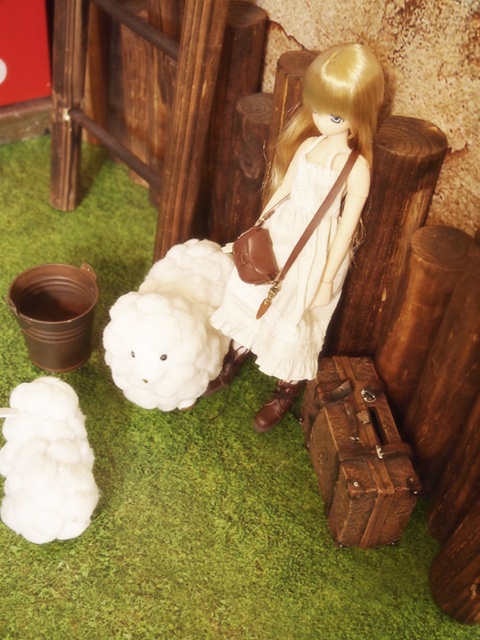
Who is taller, rustic leather suitcase at lower right or white fluffy toy at lower left?

rustic leather suitcase at lower right is taller.

Who is more forward, [357,515] or [74,408]?

Point [357,515] is in front.

In order to click on rustic leather suitcase at lower right in this screenshot , I will do `click(358, 452)`.

Does white cotton dress at center come behind white fluffy toy at lower left?

No.

Consider the image. Does white cotton dress at center have a larger size compared to white fluffy toy at lower left?

Yes.

Which is in front, point (340, 148) or point (19, 490)?

Point (340, 148)

This screenshot has width=480, height=640. I want to click on white cotton dress at center, so tap(287, 307).

Does white fluffy lamb at lower left lie behind white cotton dress at center?

Yes.

Can you confirm if white fluffy lamb at lower left is wider than white cotton dress at center?

Incorrect, white fluffy lamb at lower left's width does not surpass white cotton dress at center's.

Who is more distant from viewer, (x=193, y=349) or (x=315, y=195)?

The point (x=193, y=349) is more distant.

At what (x,y) coordinates should I click in order to perform the action: click on white fluffy lamb at lower left. Please return your answer as a coordinate pair (x, y). The width and height of the screenshot is (480, 640). Looking at the image, I should click on (169, 328).